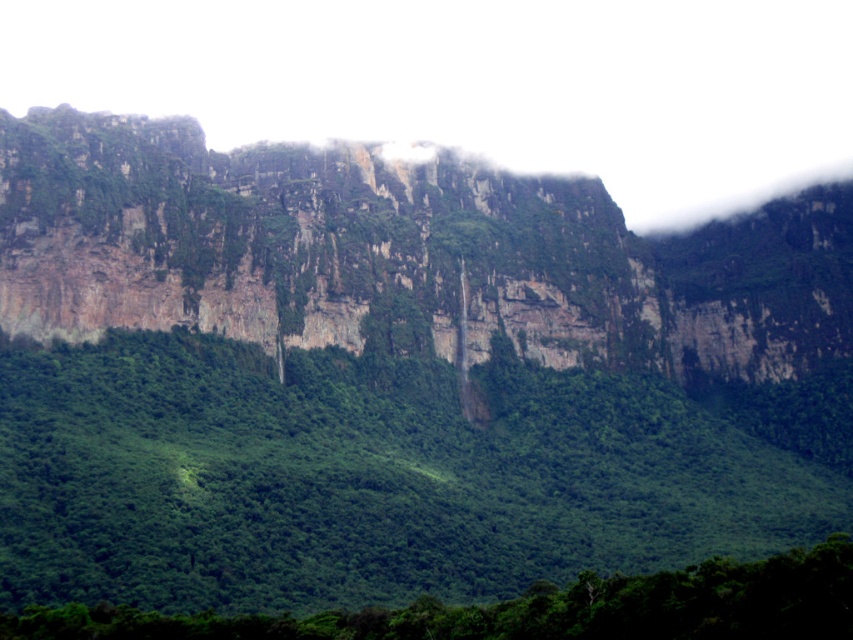
Which of these two, green leafy vegetation at center or rugged stone cliff at upper center, stands shorter?

With less height is green leafy vegetation at center.

Is green leafy vegetation at center shorter than rugged stone cliff at upper center?

Yes.

Between point (61, 548) and point (148, 280), which one is positioned behind?

The point (148, 280) is more distant.

The width and height of the screenshot is (853, 640). Find the location of `green leafy vegetation at center`. green leafy vegetation at center is located at coordinates (386, 474).

Does green leafy vegetation at center appear under green leafy forest at lower center?

Actually, green leafy vegetation at center is above green leafy forest at lower center.

Which of these two, green leafy vegetation at center or green leafy forest at lower center, stands taller?

green leafy vegetation at center is taller.

Is point (242, 404) in front of point (538, 621)?

That is False.

The image size is (853, 640). I want to click on green leafy vegetation at center, so click(386, 474).

Can you confirm if rugged stone cliff at upper center is positioned to the right of green leafy forest at lower center?

No, rugged stone cliff at upper center is not to the right of green leafy forest at lower center.

Between rugged stone cliff at upper center and green leafy forest at lower center, which one is positioned higher?

rugged stone cliff at upper center

I want to click on rugged stone cliff at upper center, so click(399, 253).

I want to click on rugged stone cliff at upper center, so click(399, 253).